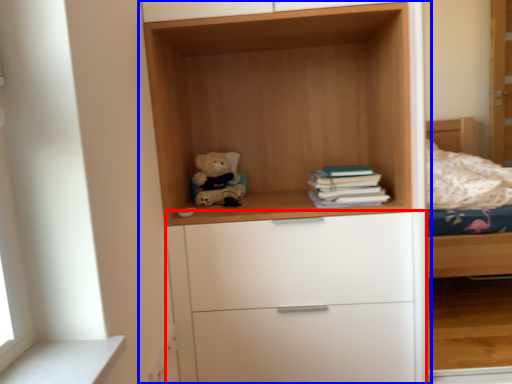
Question: Which object is further to the camera taking this photo, chest of drawers (highlighted by a red box) or cupboard (highlighted by a blue box)?

Choices:
 (A) chest of drawers
 (B) cupboard

Answer: (A)